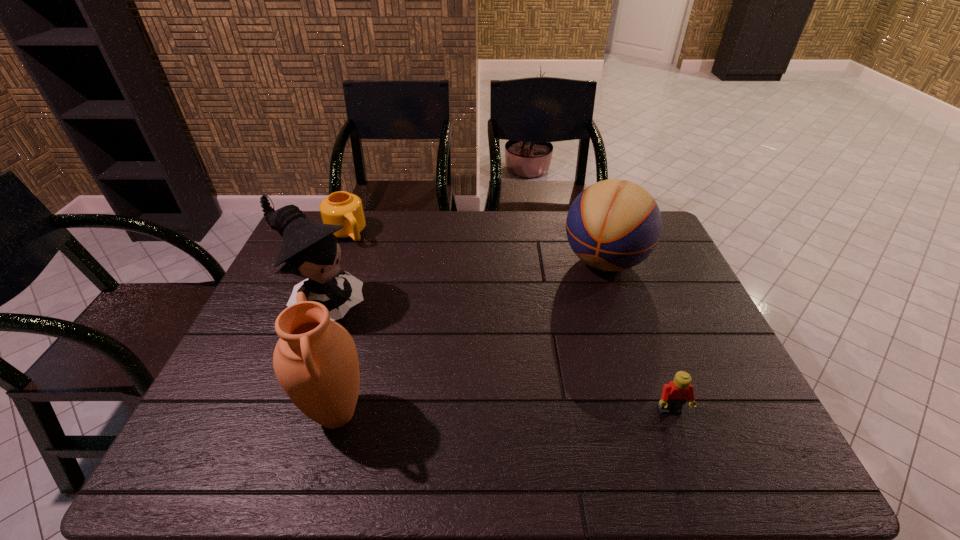
Where is `vacant region at the far right corner of the desktop`? This screenshot has height=540, width=960. vacant region at the far right corner of the desktop is located at coordinates 666,242.

At what (x,y) coordinates should I click in order to perform the action: click on free space that is in between the urn and the basketball. Please return your answer as a coordinate pair (x, y). Looking at the image, I should click on (470, 338).

Locate an element on the screen. The image size is (960, 540). empty location between the urn and the basketball is located at coordinates (470, 338).

The height and width of the screenshot is (540, 960). Identify the location of vacant area that lies between the Lego and the basketball. (637, 336).

Identify the location of free space between the doll and the basketball. The image size is (960, 540). (464, 284).

What are the coordinates of `empty space between the basketball and the urn` in the screenshot? It's located at (470, 338).

Image resolution: width=960 pixels, height=540 pixels. I want to click on vacant region between the urn and the Lego, so click(503, 413).

Where is `vacant area between the doll and the basketball`? The image size is (960, 540). vacant area between the doll and the basketball is located at coordinates (464, 284).

Locate an element on the screen. The image size is (960, 540). free space between the basketball and the doll is located at coordinates (464, 284).

I want to click on empty location between the basketball and the Lego, so click(637, 336).